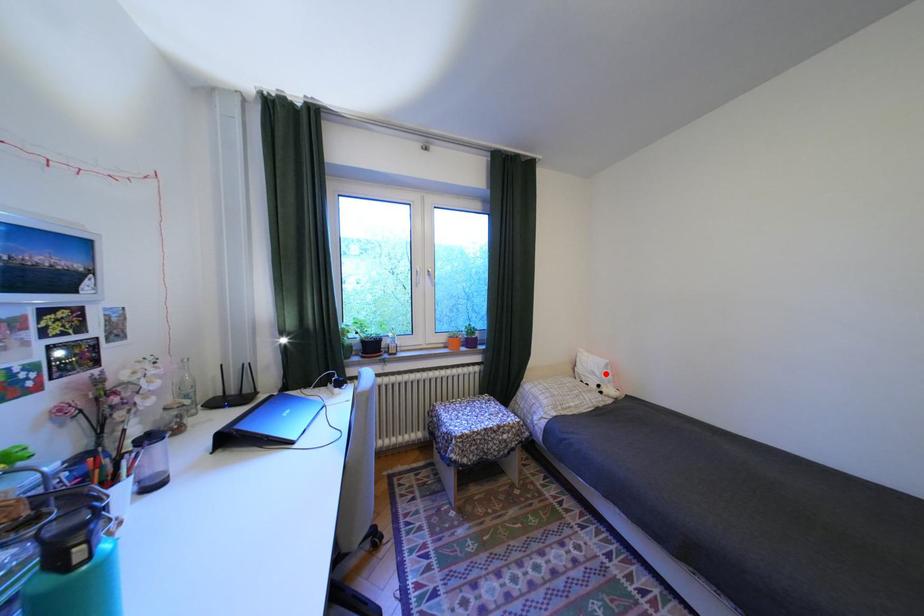
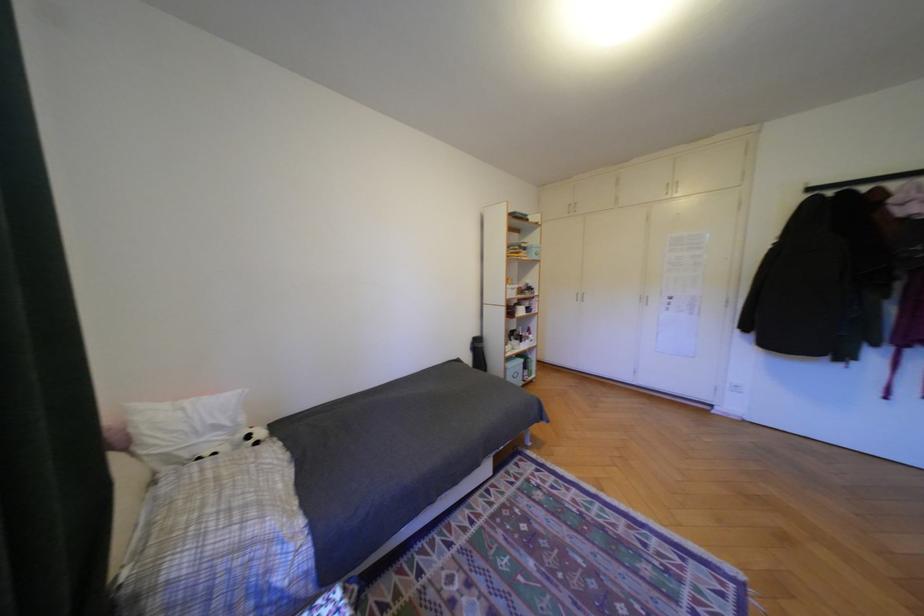
Locate, in the second image, the point that corresponds to the highlighted location in the first image.

(228, 427)